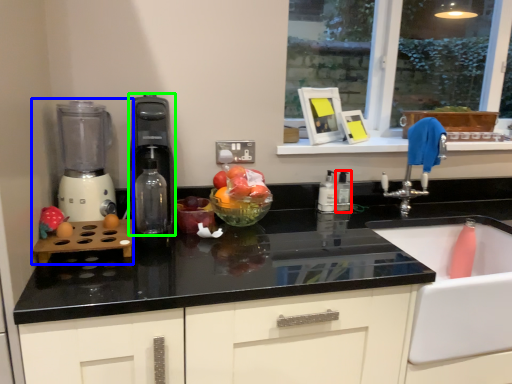
Question: Based on their relative distances, which object is nearer to bottle (highlighted by a red box)? Choose from mixer (highlighted by a blue box) and kitchen appliance (highlighted by a green box).

Choices:
 (A) mixer
 (B) kitchen appliance

Answer: (B)